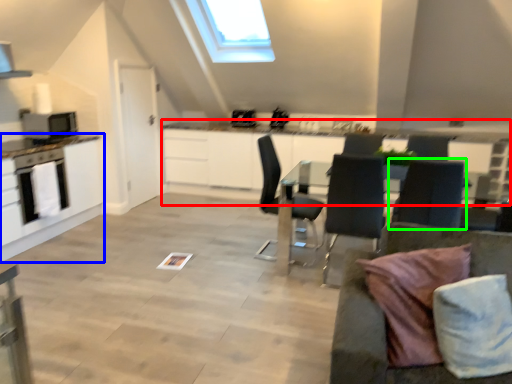
Question: Based on their relative distances, which object is nearer to counter (highlighted by a red box)? Choose from cabinetry (highlighted by a blue box) and chair (highlighted by a green box).

Choices:
 (A) cabinetry
 (B) chair

Answer: (A)